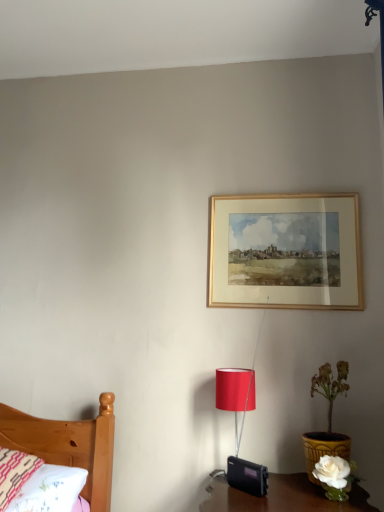
Question: Can you confirm if white ceramic vase at lower right is shorter than gold wooden picture frame at upper center?

Choices:
 (A) yes
 (B) no

Answer: (A)

Question: From the image's perspective, is white ceramic vase at lower right over gold wooden picture frame at upper center?

Choices:
 (A) no
 (B) yes

Answer: (A)

Question: Can you confirm if white ceramic vase at lower right is thinner than gold wooden picture frame at upper center?

Choices:
 (A) no
 (B) yes

Answer: (A)

Question: Considering the relative sizes of white ceramic vase at lower right and gold wooden picture frame at upper center in the image provided, is white ceramic vase at lower right wider than gold wooden picture frame at upper center?

Choices:
 (A) no
 (B) yes

Answer: (B)

Question: Is gold wooden picture frame at upper center a part of white ceramic vase at lower right?

Choices:
 (A) no
 (B) yes

Answer: (A)

Question: Is white ceramic vase at lower right far from gold wooden picture frame at upper center?

Choices:
 (A) yes
 (B) no

Answer: (B)

Question: Would you say embroidered cotton pillow at lower left is outside gold wooden picture frame at upper center?

Choices:
 (A) yes
 (B) no

Answer: (A)

Question: Is embroidered cotton pillow at lower left further to camera compared to gold wooden picture frame at upper center?

Choices:
 (A) yes
 (B) no

Answer: (B)

Question: Considering the relative sizes of embroidered cotton pillow at lower left and gold wooden picture frame at upper center in the image provided, is embroidered cotton pillow at lower left thinner than gold wooden picture frame at upper center?

Choices:
 (A) yes
 (B) no

Answer: (B)

Question: Does embroidered cotton pillow at lower left appear on the right side of gold wooden picture frame at upper center?

Choices:
 (A) no
 (B) yes

Answer: (A)

Question: From the image's perspective, is embroidered cotton pillow at lower left on top of gold wooden picture frame at upper center?

Choices:
 (A) yes
 (B) no

Answer: (B)

Question: From a real-world perspective, is embroidered cotton pillow at lower left over gold wooden picture frame at upper center?

Choices:
 (A) no
 (B) yes

Answer: (A)

Question: Does gold wooden picture frame at upper center have a greater height compared to embroidered cotton pillow at lower left?

Choices:
 (A) yes
 (B) no

Answer: (A)